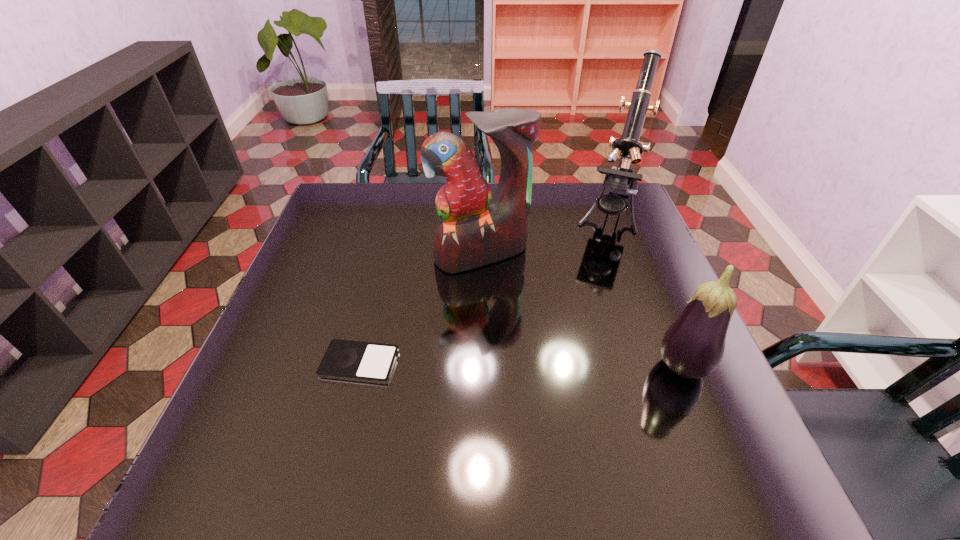
Identify the location of vacant area at the near edge of the desktop. (505, 417).

Where is `vacant space at the left edge of the desktop`? Image resolution: width=960 pixels, height=540 pixels. vacant space at the left edge of the desktop is located at coordinates (337, 306).

Image resolution: width=960 pixels, height=540 pixels. In the image, there is a desktop. Identify the location of vacant space at the right edge. (625, 276).

Where is `free region at the far right corner of the desktop`? This screenshot has height=540, width=960. free region at the far right corner of the desktop is located at coordinates click(591, 186).

At what (x,y) coordinates should I click in order to perform the action: click on vacant space at the near right corner. Please return your answer as a coordinate pair (x, y). Looking at the image, I should click on point(735,430).

Find the location of a particular element. The width and height of the screenshot is (960, 540). free point between the second shortest object and the leftmost object is located at coordinates (520, 367).

The height and width of the screenshot is (540, 960). Find the location of `free spot between the parrot and the microscope`. free spot between the parrot and the microscope is located at coordinates (545, 235).

Find the location of a particular element. The width and height of the screenshot is (960, 540). unoccupied position between the third tallest object and the iPod is located at coordinates (520, 367).

At what (x,y) coordinates should I click in order to perform the action: click on vacant region between the second shortest object and the third object from right to left. Please return your answer as a coordinate pair (x, y). Looking at the image, I should click on (582, 312).

Locate an element on the screen. The width and height of the screenshot is (960, 540). blank region between the microscope and the second object from left to right is located at coordinates (545, 235).